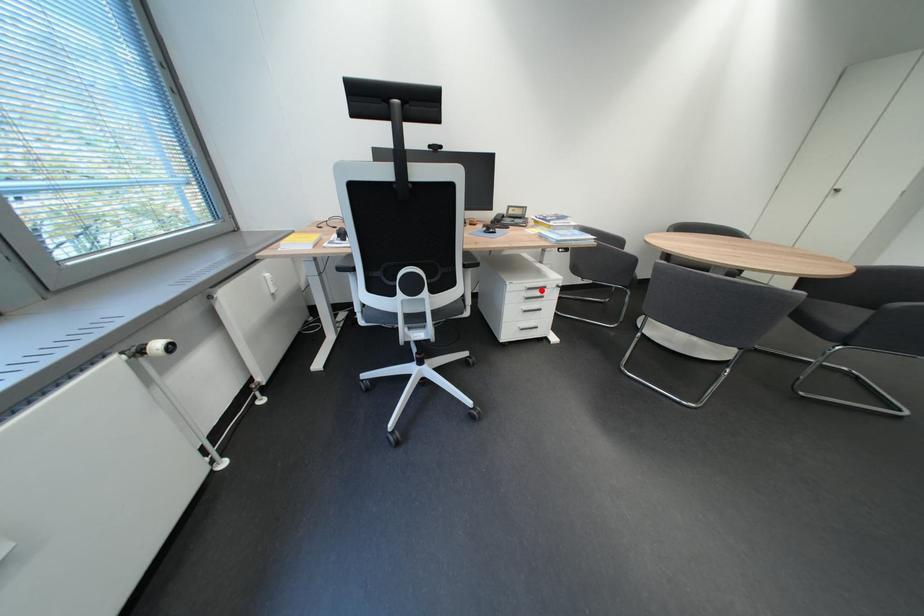
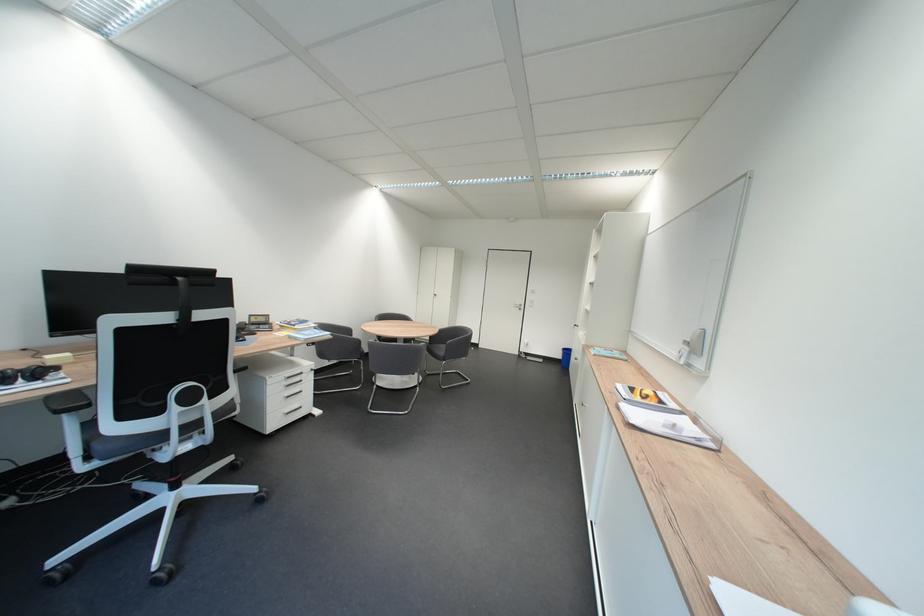
In the second image, find the point that corresponds to the highlighted location in the first image.

(300, 379)